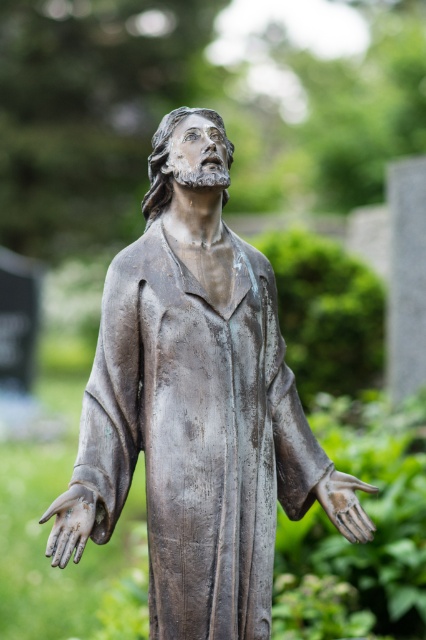
You are standing in front of the statue and notice a specific point marked at coordinates [69,524]. Based on the statue description, what object or feature is located at this point?

The point at [69,524] marks the bronze textured hand at lower left of the statue.

Consider the image. You are standing in front of the bronze statue and want to place a small offering at the base. The statue has two points marked at coordinates point (85, 518) and point (359, 516). Which point is closer to you when facing the statue?

Point (85, 518) is in front of point (359, 516), so when facing the statue, point (85, 518) is closer to you.

You are a sculptor who wants to place a small plaque between the bronze statue at center and the bronze textured hand at lower left. The plaque is 10 centimeters long. Is there enough space between them to fit the plaque without overlapping either object?

The bronze statue at center and bronze textured hand at lower left are 14.47 centimeters apart. Since the plaque is 10 centimeters long, there is sufficient space between them to fit the plaque without overlapping either object.